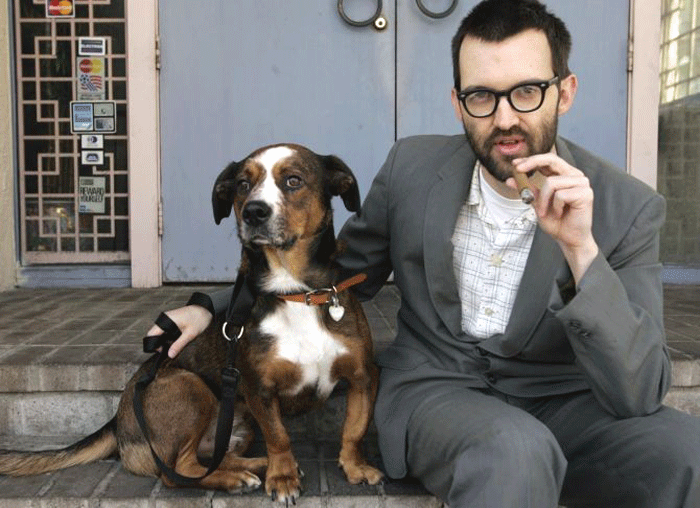
The height and width of the screenshot is (508, 700). I want to click on entrance, so click(41, 79).